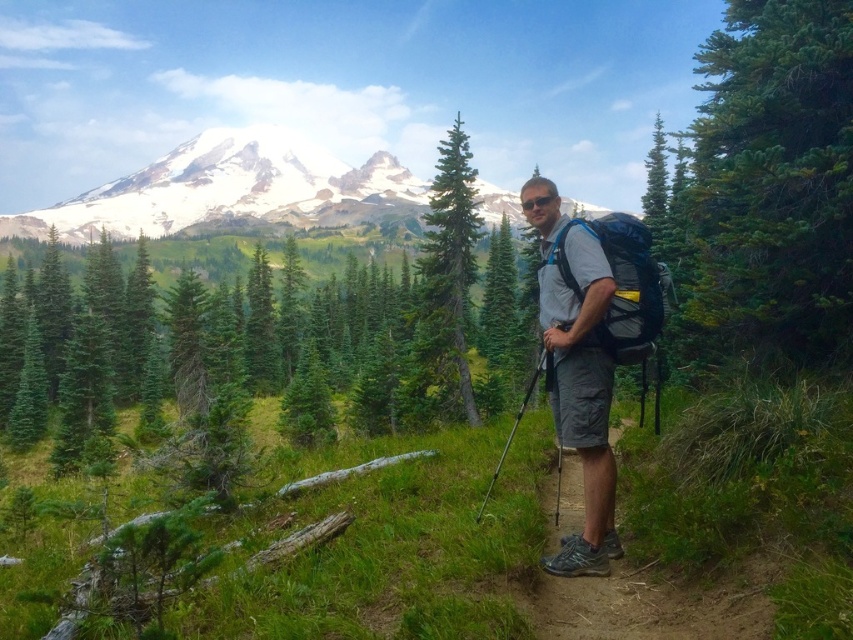
You are a hiker who wants to take a photo of the green textured pine tree at center right. You are currently standing at point (770,186). Can you take a clear photo of the green textured pine tree at center right from your current position?

Point (770,186) is on green textured pine tree at center right, so you can take a clear photo of the green textured pine tree at center right from your current position because you are already positioned on it.

You are a hiker who wants to take a photo of the gray fabric backpack at center and the green textured pine tree at center. Which object is located to the right of the other?

The gray fabric backpack at center is positioned on the right side of green textured pine tree at center, so the backpack is to the right of the pine tree.